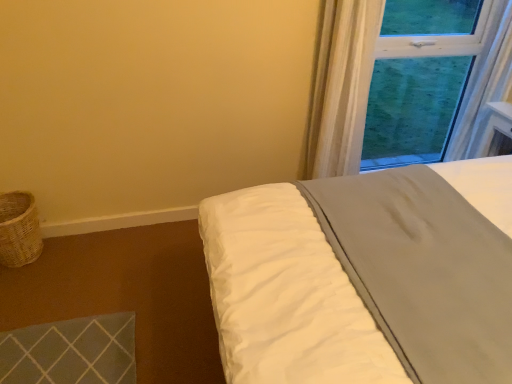
Question: In the image, is white sheer curtain at upper right positioned in front of or behind white soft bed at upper right?

Choices:
 (A) behind
 (B) front

Answer: (A)

Question: Would you say white sheer curtain at upper right is to the left or to the right of white soft bed at upper right in the picture?

Choices:
 (A) right
 (B) left

Answer: (B)

Question: Which of these objects is positioned closest to the woven wicker basket at lower left?

Choices:
 (A) white sheer curtain at upper right
 (B) white soft bed at upper right

Answer: (B)

Question: Estimate the real-world distances between objects in this image. Which object is farther from the white soft bed at upper right?

Choices:
 (A) woven wicker basket at lower left
 (B) white sheer curtain at upper right

Answer: (A)